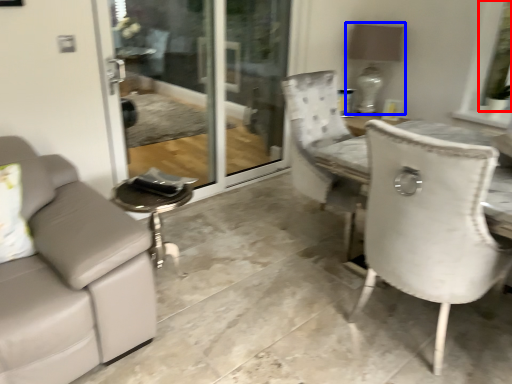
Question: Which of the following is the closest to the observer, window screen (highlighted by a red box) or lamp (highlighted by a blue box)?

Choices:
 (A) window screen
 (B) lamp

Answer: (A)